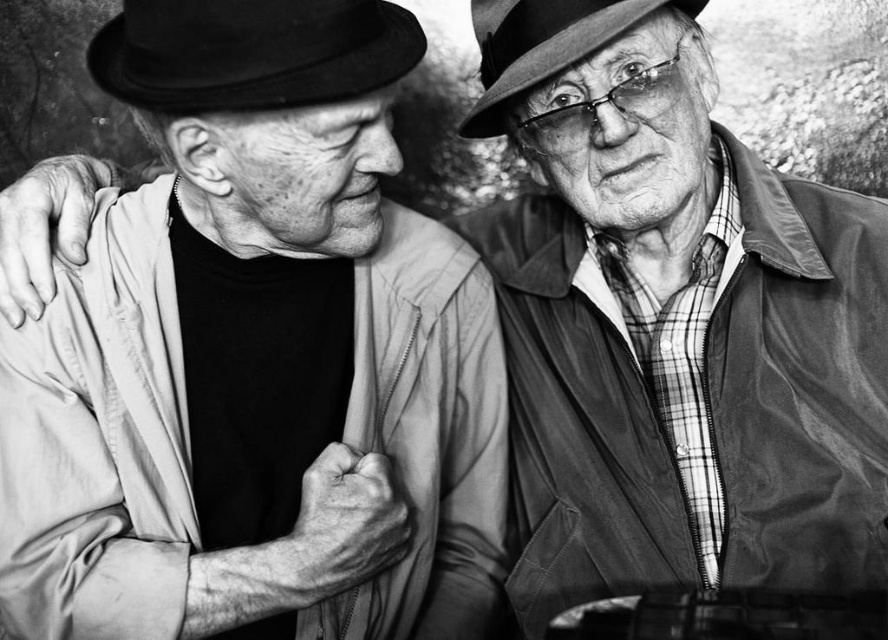
Does black felt fedora at upper left have a lesser width compared to matte black hat at upper right?

No.

This screenshot has height=640, width=888. Identify the location of black felt fedora at upper left. (251, 52).